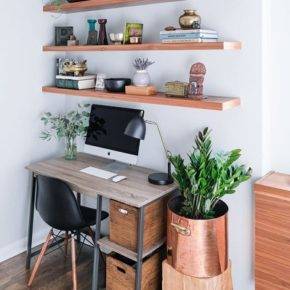
The image size is (290, 290). Find the location of `bowl`. bowl is located at coordinates (120, 84).